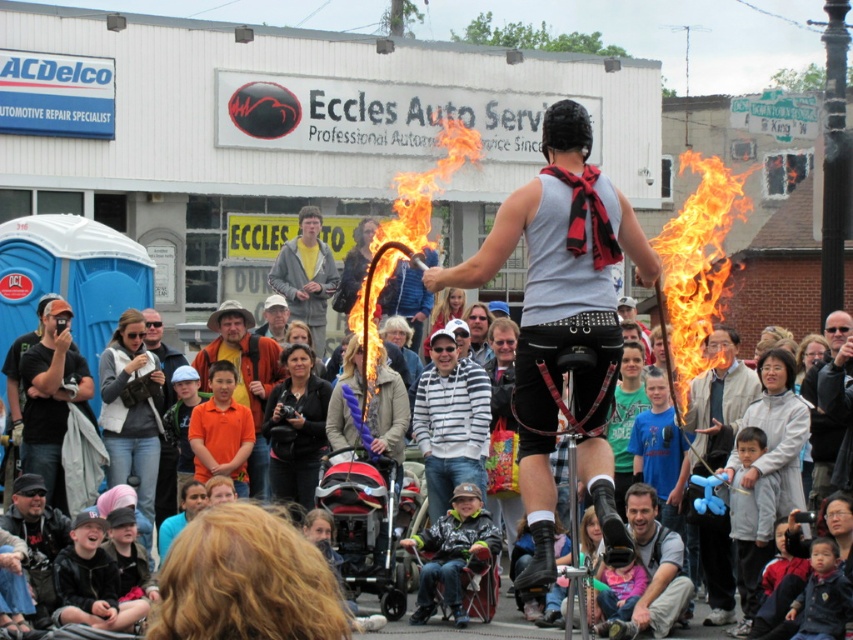
Can you confirm if striped cotton hoodie at center is positioned below denim jacket at lower left?

Yes.

Which is more to the left, striped cotton hoodie at center or denim jacket at lower left?

denim jacket at lower left is more to the left.

Measure the distance between striped cotton hoodie at center and camera.

They are 50.74 meters apart.

Identify the location of striped cotton hoodie at center. (450, 420).

Can you confirm if denim jacket at lower left is shorter than black fabric camera at center?

No, denim jacket at lower left is not shorter than black fabric camera at center.

Between denim jacket at lower left and black fabric camera at center, which one is positioned higher?

denim jacket at lower left is above.

Describe the element at coordinates (131, 408) in the screenshot. I see `denim jacket at lower left` at that location.

Where is `denim jacket at lower left`? Image resolution: width=853 pixels, height=640 pixels. denim jacket at lower left is located at coordinates (131, 408).

Does point (407, 189) come behind point (688, 600)?

Yes, it is.

Can you confirm if flameflame at center is bigger than matte black camera at lower center?

Indeed, flameflame at center has a larger size compared to matte black camera at lower center.

At what (x,y) coordinates should I click in order to perform the action: click on flameflame at center. Please return your answer as a coordinate pair (x, y). The width and height of the screenshot is (853, 640). Looking at the image, I should click on (407, 228).